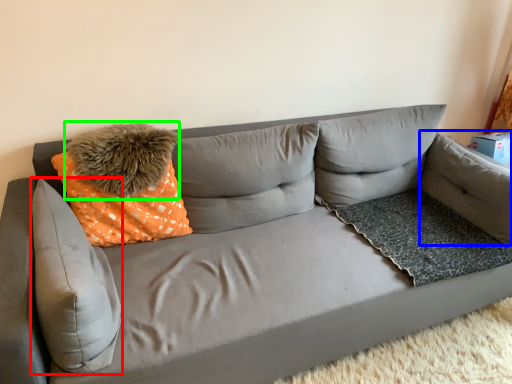
Question: Which object is the farthest from pillow (highlighted by a red box)? Choose among these: pillow (highlighted by a blue box) or pillow (highlighted by a green box).

Choices:
 (A) pillow
 (B) pillow

Answer: (A)